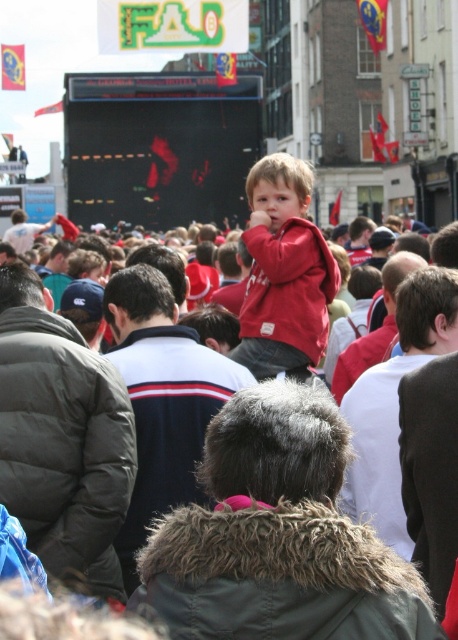
Is fur-lined green jacket at center in front of dark blue fleece jacket at center?

Yes, it is.

Is point (370, 627) positioned in front of point (147, 320)?

Yes, point (370, 627) is closer to viewer.

Locate an element on the screen. fur-lined green jacket at center is located at coordinates (278, 577).

Between dark gray puffer jacket at left and dark blue fleece jacket at center, which one is positioned higher?

Positioned higher is dark blue fleece jacket at center.

Does dark gray puffer jacket at left appear under dark blue fleece jacket at center?

Yes, dark gray puffer jacket at left is below dark blue fleece jacket at center.

The height and width of the screenshot is (640, 458). What do you see at coordinates (65, 448) in the screenshot?
I see `dark gray puffer jacket at left` at bounding box center [65, 448].

The height and width of the screenshot is (640, 458). In order to click on dark gray puffer jacket at left in this screenshot , I will do `click(65, 448)`.

From the picture: Who is lower down, dark brown suit at center or dark gray puffer jacket at center?

Positioned lower is dark brown suit at center.

Between dark brown suit at center and dark gray puffer jacket at center, which one appears on the right side from the viewer's perspective?

dark brown suit at center is more to the right.

Who is more forward, [386,541] or [21,252]?

Point [386,541] is more forward.

Locate an element on the screen. The width and height of the screenshot is (458, 640). dark brown suit at center is located at coordinates (394, 403).